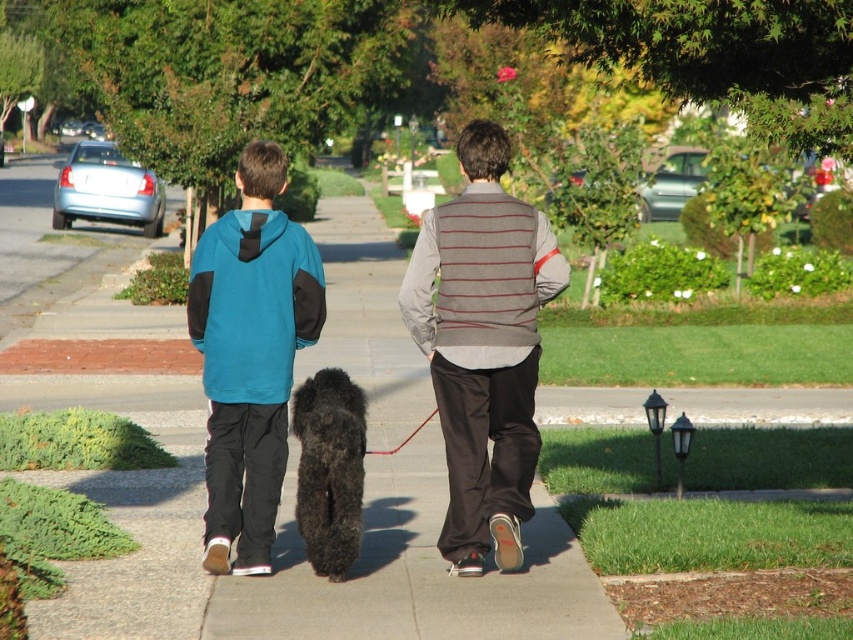
Question: Can you confirm if striped knit vest at center is positioned below black fuzzy dog at center?

Choices:
 (A) no
 (B) yes

Answer: (A)

Question: Can you confirm if black asphalt sidewalk at center is bigger than black fuzzy dog at center?

Choices:
 (A) yes
 (B) no

Answer: (A)

Question: Which object is the closest to the black fuzzy dog at center?

Choices:
 (A) black asphalt sidewalk at center
 (B) striped knit vest at center
 (C) teal fleece hoodie at center

Answer: (C)

Question: Can you confirm if black asphalt sidewalk at center is wider than striped knit vest at center?

Choices:
 (A) yes
 (B) no

Answer: (A)

Question: Which of the following is the closest to the observer?

Choices:
 (A) (328, 481)
 (B) (422, 316)

Answer: (B)

Question: Which point is farther to the camera?

Choices:
 (A) (463, 492)
 (B) (311, 516)

Answer: (B)